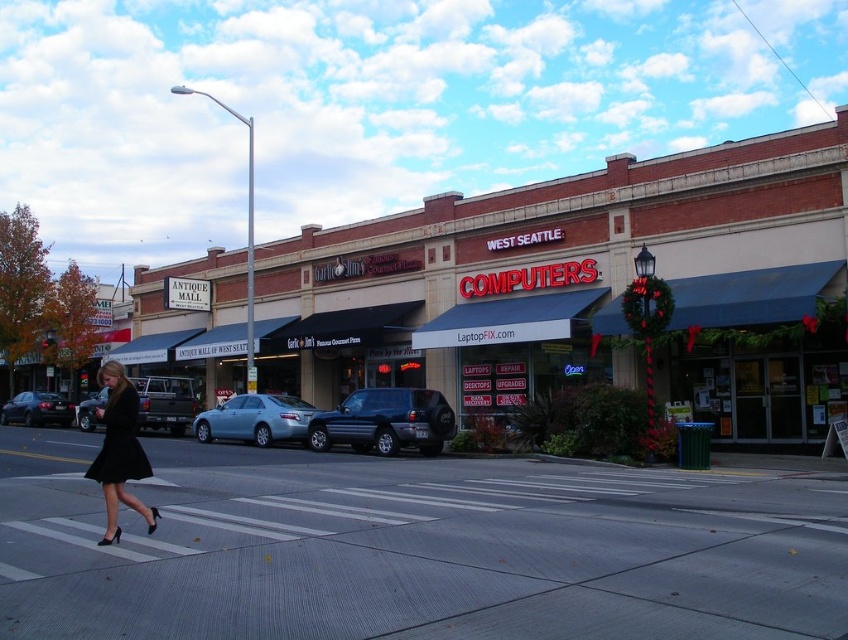
Looking at this image, you are a pedestrian standing at the crosswalk and see the black matte dress at lower left and the matte black sedan at lower left. Which object is positioned more to the right side of the frame?

The black matte dress at lower left is positioned more to the right side of the frame compared to the matte black sedan at lower left.

You are a delivery person needing to place a package between the satin silver suv at center and the black matte dress at lower left. The package requires 20 feet of space. Can you fit it between them?

The satin silver suv at center and black matte dress at lower left are 22.57 feet apart from each other. Since the required space is 20 feet, the package can be placed between them as there is enough space.